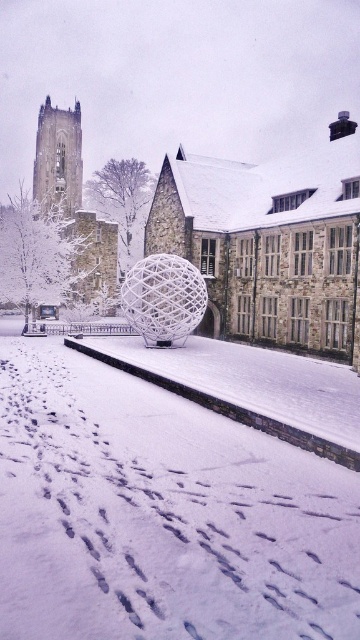
Can you confirm if white wire mesh sphere at center is positioned above stone tower at upper left?

Incorrect, white wire mesh sphere at center is not positioned above stone tower at upper left.

Is white wire mesh sphere at center wider than stone tower at upper left?

Yes.

This screenshot has width=360, height=640. Find the location of `white wire mesh sphere at center`. white wire mesh sphere at center is located at coordinates (270, 243).

Is point (105, 426) behind point (185, 173)?

That is False.

Measure the distance between white powdery snow at center and camera.

A distance of 43.73 feet exists between white powdery snow at center and camera.

The height and width of the screenshot is (640, 360). In order to click on white powdery snow at center in this screenshot , I will do `click(160, 515)`.

Can you confirm if white powdery snow at center is bigger than stone tower at left?

No.

This screenshot has height=640, width=360. Identify the location of white powdery snow at center. (160, 515).